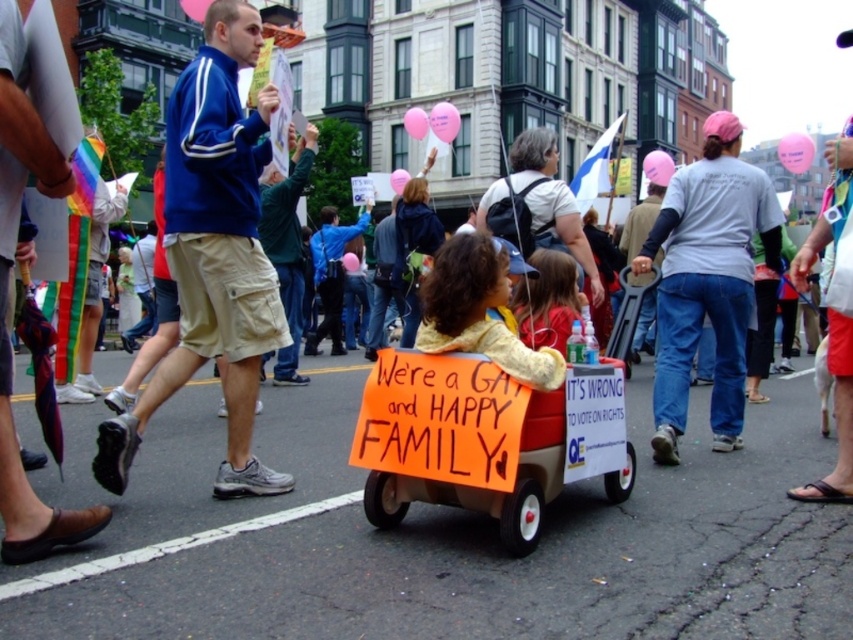
Question: Which of these objects is positioned farthest from the matte white shirt at center?

Choices:
 (A) orange cardboard wagon at center
 (B) soft yellow sweater at center

Answer: (B)

Question: Which object is closer to the camera taking this photo?

Choices:
 (A) gray cotton shirt at center
 (B) blue fabric jacket at center
 (C) matte white shirt at center

Answer: (B)

Question: Can you confirm if orange cardboard wagon at center is positioned to the left of gray cotton shirt at center?

Choices:
 (A) no
 (B) yes

Answer: (B)

Question: Can you confirm if soft yellow sweater at center is wider than matte white shirt at center?

Choices:
 (A) yes
 (B) no

Answer: (B)

Question: Which object is the farthest from the matte white shirt at center?

Choices:
 (A) blue fabric jacket at center
 (B) orange cardboard wagon at center
 (C) gray cotton shirt at center

Answer: (A)

Question: In this image, where is orange cardboard wagon at center located relative to matte white shirt at center?

Choices:
 (A) left
 (B) right

Answer: (A)